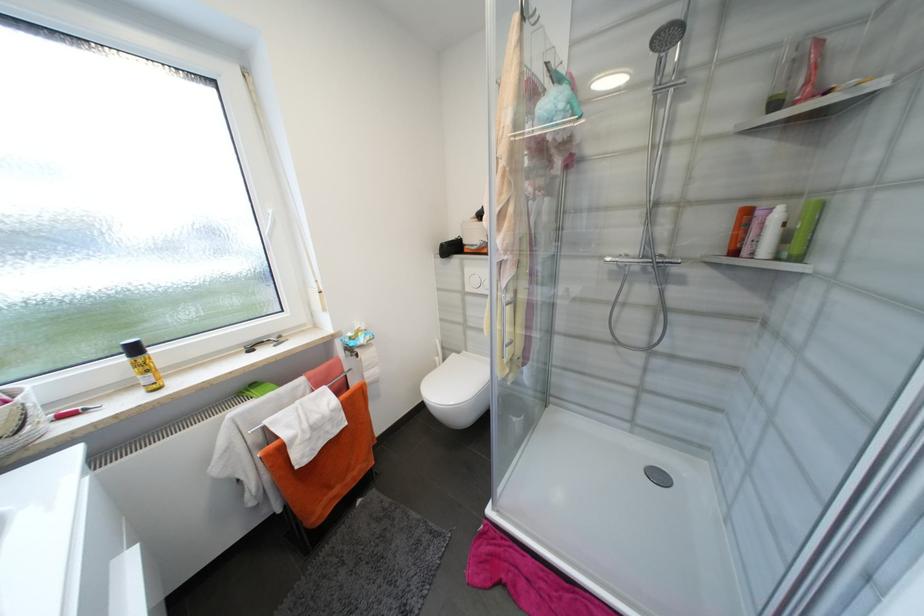
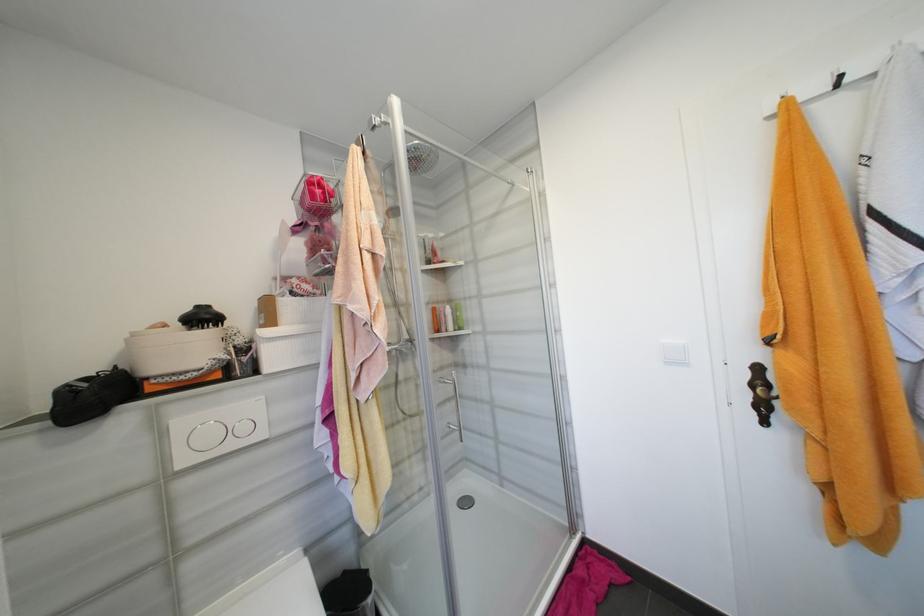
Where in the second image is the point corresponding to (473,290) from the first image?

(189, 463)